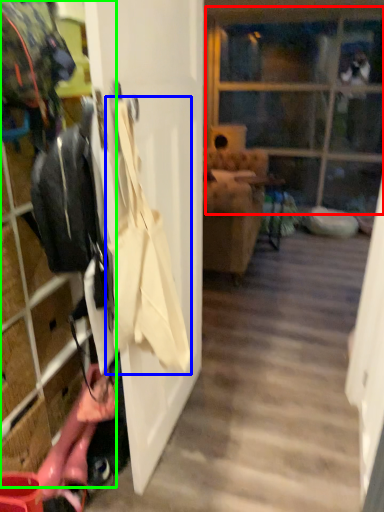
Question: Based on their relative distances, which object is farther from glass door (highlighted by a red box)? Choose from shoulder bag (highlighted by a blue box) and closet (highlighted by a green box).

Choices:
 (A) shoulder bag
 (B) closet

Answer: (A)